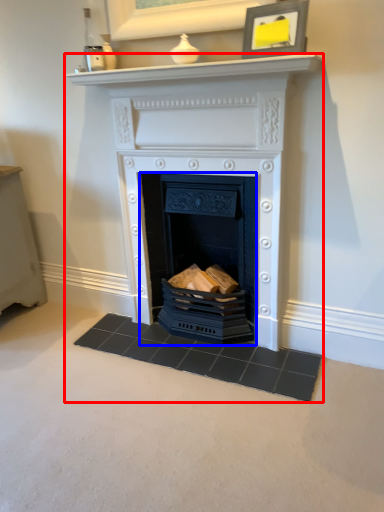
Question: Which object is closer to the camera taking this photo, fireplace (highlighted by a red box) or fireplace (highlighted by a blue box)?

Choices:
 (A) fireplace
 (B) fireplace

Answer: (A)